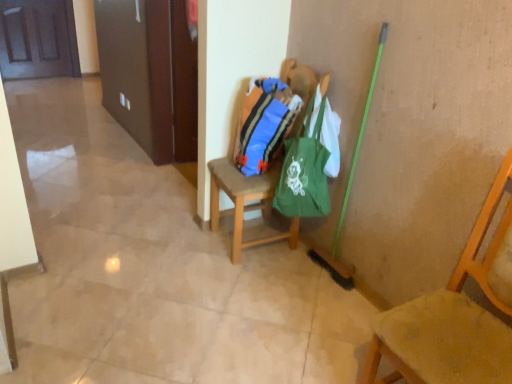
You are a GUI agent. You are given a task and a screenshot of the screen. Output one action in this format:
    pyautogui.click(x=<x>, y=<y>)
    Task: Click on the wooden chair at right, the 2th chair viewed from the left
    This screenshot has height=384, width=512.
    Given the screenshot: What is the action you would take?
    pyautogui.click(x=455, y=315)

What is the approximate width of wooden chair at right, acting as the 1th chair starting from the right?

The width of wooden chair at right, acting as the 1th chair starting from the right, is 19.83 inches.

Find the location of a particular element. The image size is (512, 384). wooden chair at right, acting as the 1th chair starting from the right is located at coordinates (455, 315).

Between green canvas tote at center and wooden chair at right, acting as the 1th chair starting from the right, which one has smaller width?

With smaller width is green canvas tote at center.

Which is in front, point (313, 199) or point (484, 347)?

Positioned in front is point (484, 347).

How far apart are green canvas tote at center and wooden chair at right, the 2th chair viewed from the left?

31.75 inches.

In the image, is green canvas tote at center positioned in front of or behind wooden chair at right, the 2th chair viewed from the left?

green canvas tote at center is positioned farther from the viewer than wooden chair at right, the 2th chair viewed from the left.

Is the depth of blue striped fabric bag at center greater than that of wooden door at upper left?

No, blue striped fabric bag at center is in front of wooden door at upper left.

How much distance is there between blue striped fabric bag at center and wooden door at upper left?

They are 13.67 feet apart.

From a real-world perspective, is blue striped fabric bag at center physically below wooden door at upper left?

No.

Looking at this image, is blue striped fabric bag at center positioned with its back to wooden chair at right, which appears as the second chair when viewed from the back?

No.

From the picture: Is wooden chair at right, the 2th chair viewed from the left, a part of blue striped fabric bag at center?

That's incorrect, wooden chair at right, the 2th chair viewed from the left, is not inside blue striped fabric bag at center.

Is blue striped fabric bag at center taller than wooden chair at right, which is counted as the 1th chair, starting from the front?

In fact, blue striped fabric bag at center may be shorter than wooden chair at right, which is counted as the 1th chair, starting from the front.

Between blue striped fabric bag at center and wooden chair at right, acting as the 1th chair starting from the right, which one has larger size?

Bigger between the two is wooden chair at right, acting as the 1th chair starting from the right.

From the image's perspective, which one is positioned higher, wooden chair at center, positioned as the second chair in front-to-back order, or wooden chair at right, which appears as the second chair when viewed from the back?

wooden chair at center, positioned as the second chair in front-to-back order.

Can you tell me how much wooden chair at center, which is counted as the first chair, starting from the back, and wooden chair at right, which is counted as the 1th chair, starting from the front, differ in facing direction?

wooden chair at center, which is counted as the first chair, starting from the back, and wooden chair at right, which is counted as the 1th chair, starting from the front, are facing 2.81 degrees away from each other.

From a real-world perspective, is wooden chair at center, positioned as the second chair in front-to-back order, physically below wooden chair at right, the 2th chair viewed from the left?

Yes, from a real-world perspective, wooden chair at center, positioned as the second chair in front-to-back order, is below wooden chair at right, the 2th chair viewed from the left.

Considering the relative sizes of wooden chair at center, positioned as the second chair in front-to-back order, and wooden chair at right, which is counted as the 1th chair, starting from the front, in the image provided, is wooden chair at center, positioned as the second chair in front-to-back order, shorter than wooden chair at right, which is counted as the 1th chair, starting from the front,?

Correct, wooden chair at center, positioned as the second chair in front-to-back order, is not as tall as wooden chair at right, which is counted as the 1th chair, starting from the front.

Between point (282, 137) and point (305, 145), which one is positioned in front?

The point (305, 145) is in front.

Are blue striped fabric bag at center and green canvas tote at center beside each other?

No, blue striped fabric bag at center is not next to green canvas tote at center.

Is green canvas tote at center at the back of blue striped fabric bag at center?

blue striped fabric bag at center does not have its back to green canvas tote at center.

From a real-world perspective, who is located higher, blue striped fabric bag at center or green canvas tote at center?

blue striped fabric bag at center, from a real-world perspective.

Looking at this image, from a real-world perspective, is wooden chair at right, which is counted as the 1th chair, starting from the front, located higher than wooden door at upper left?

Correct, in the physical world, wooden chair at right, which is counted as the 1th chair, starting from the front, is higher than wooden door at upper left.

Which object is thinner, wooden chair at right, which appears as the second chair when viewed from the back, or wooden door at upper left?

wooden door at upper left is thinner.

Is point (476, 322) closer or farther from the camera than point (52, 32)?

Point (476, 322) appears to be closer to the viewer than point (52, 32).

The image size is (512, 384). I want to click on chair that is the 2nd one above the wooden door at upper left (from a real-world perspective), so click(455, 315).

Is point (305, 204) closer or farther from the camera than point (248, 163)?

Clearly, point (305, 204) is closer to the camera than point (248, 163).

From a real-world perspective, is green canvas tote at center physically above blue striped fabric bag at center?

No.

Consider the image. Measure the distance between green canvas tote at center and blue striped fabric bag at center.

green canvas tote at center is 19.70 centimeters away from blue striped fabric bag at center.

Can you confirm if green canvas tote at center is taller than blue striped fabric bag at center?

Correct, green canvas tote at center is much taller as blue striped fabric bag at center.

Where is `shoulder bag on the left of wooden chair at right, the 2th chair viewed from the left`? shoulder bag on the left of wooden chair at right, the 2th chair viewed from the left is located at coordinates (304, 172).

Find the location of a particular element. Image resolution: width=512 pixels, height=384 pixels. bag positioned vertically above the wooden door at upper left (from a real-world perspective) is located at coordinates (264, 124).

Based on their spatial positions, is wooden door at upper left or wooden chair at center, which is the first chair in left-to-right order, further from wooden chair at right, which appears as the second chair when viewed from the back?

wooden door at upper left.

In the scene shown: Based on their spatial positions, is wooden chair at center, which ranks as the 2th chair in right-to-left order, or wooden chair at right, which appears as the second chair when viewed from the back, closer to blue striped fabric bag at center?

wooden chair at center, which ranks as the 2th chair in right-to-left order, lies closer to blue striped fabric bag at center than the other object.

Considering their positions, is wooden chair at center, which ranks as the 2th chair in right-to-left order, positioned closer to wooden chair at right, acting as the 1th chair starting from the right, than wooden door at upper left?

Among the two, wooden chair at center, which ranks as the 2th chair in right-to-left order, is located nearer to wooden chair at right, acting as the 1th chair starting from the right.

From the image, which object appears to be farther from blue striped fabric bag at center, wooden door at upper left or green canvas tote at center?

wooden door at upper left.

Considering their positions, is blue striped fabric bag at center positioned closer to wooden chair at center, which ranks as the 2th chair in right-to-left order, than wooden door at upper left?

blue striped fabric bag at center is closer to wooden chair at center, which ranks as the 2th chair in right-to-left order.

Considering their positions, is green canvas tote at center positioned further to wooden door at upper left than wooden chair at center, positioned as the second chair in front-to-back order?

Among the two, green canvas tote at center is located further to wooden door at upper left.

Considering their positions, is wooden door at upper left positioned closer to blue striped fabric bag at center than wooden chair at center, which is the first chair in left-to-right order?

wooden chair at center, which is the first chair in left-to-right order, is positioned closer to the anchor blue striped fabric bag at center.

Estimate the real-world distances between objects in this image. Which object is closer to blue striped fabric bag at center, wooden chair at right, the 2th chair viewed from the left, or green canvas tote at center?

Among the two, green canvas tote at center is located nearer to blue striped fabric bag at center.

Where is `bag situated between wooden door at upper left and green canvas tote at center from left to right`? The width and height of the screenshot is (512, 384). bag situated between wooden door at upper left and green canvas tote at center from left to right is located at coordinates (264, 124).

Find the location of a particular element. This screenshot has height=384, width=512. chair between wooden chair at right, the 2th chair viewed from the left, and blue striped fabric bag at center from front to back is located at coordinates (245, 201).

Identify the location of bag between wooden chair at center, which is the first chair in left-to-right order, and green canvas tote at center from left to right. This screenshot has width=512, height=384. (264, 124).

At what (x,y) coordinates should I click in order to perform the action: click on chair located between green canvas tote at center and wooden door at upper left in the depth direction. Please return your answer as a coordinate pair (x, y). Looking at the image, I should click on (245, 201).